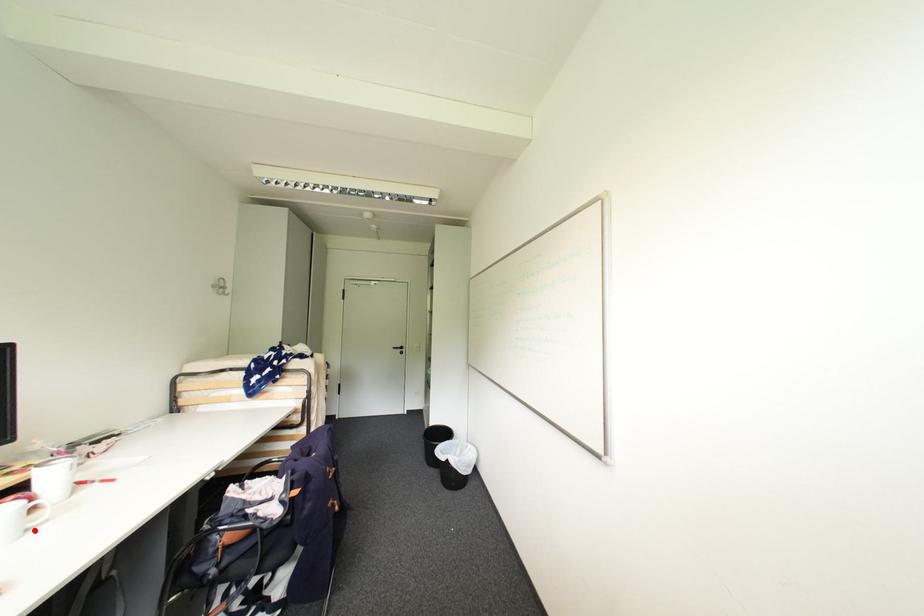
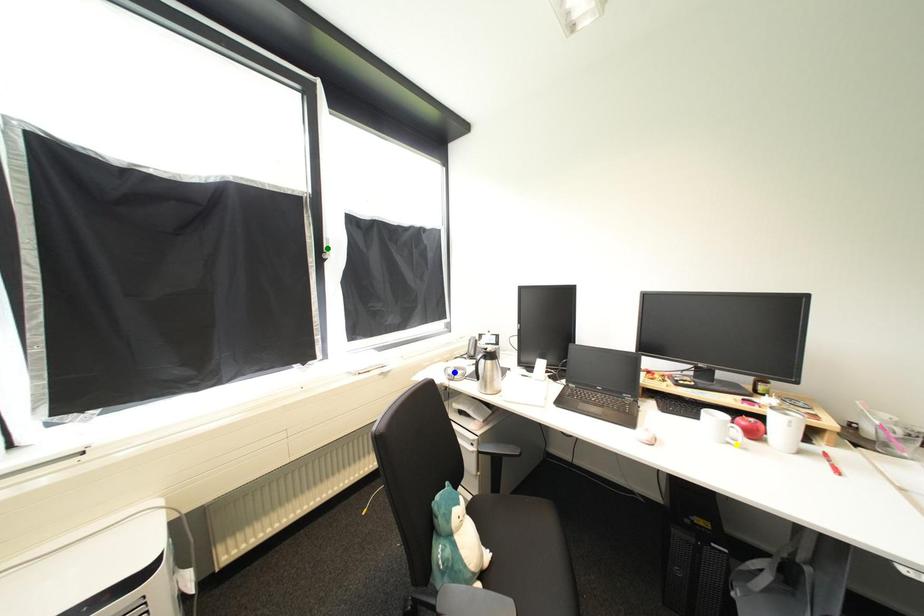
Question: I am providing you with two images of the same scene from different viewpoints. A red point is marked on the first image. You are given multiple points on the second image. In image 2, which mark is for the same physical point as the one in image 1?

Choices:
 (A) green point
 (B) blue point
 (C) yellow point

Answer: (C)